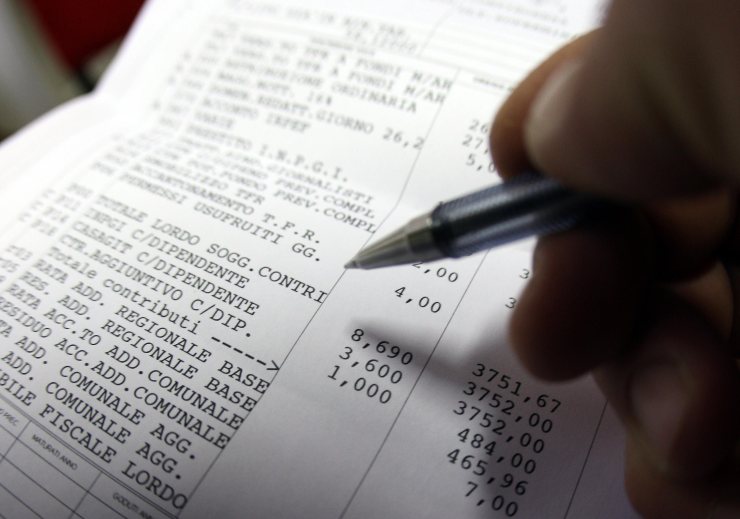
At what (x,y) coordinates should I click in order to perform the action: click on pen. Please return your answer as a coordinate pair (x, y). This screenshot has width=740, height=519. Looking at the image, I should click on (419, 224).